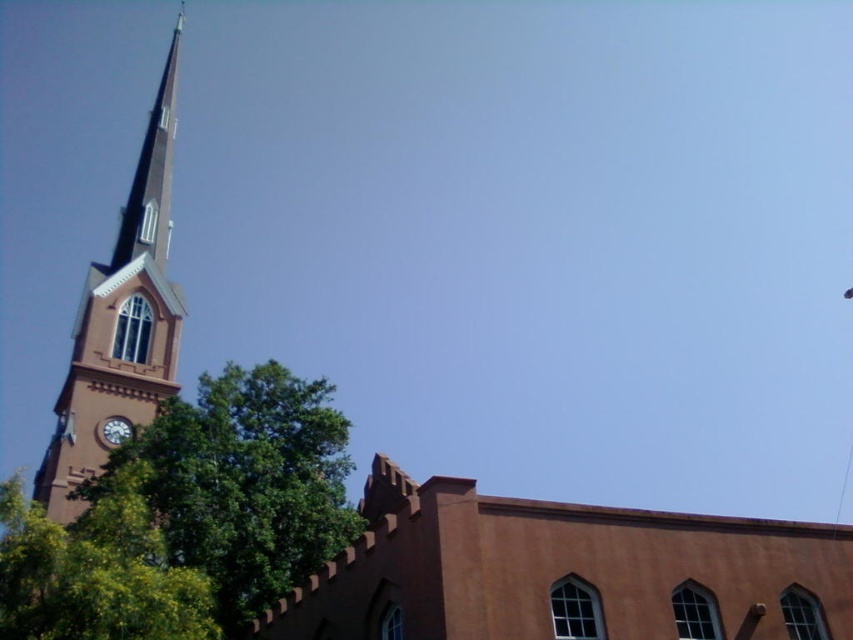
Can you confirm if green leafy tree at center is positioned to the left of smooth brown clock tower at left?

In fact, green leafy tree at center is to the right of smooth brown clock tower at left.

Image resolution: width=853 pixels, height=640 pixels. Describe the element at coordinates (244, 483) in the screenshot. I see `green leafy tree at center` at that location.

Measure the distance between point (x=296, y=432) and camera.

Point (x=296, y=432) and camera are 56.00 meters apart.

Where is `green leafy tree at center`? green leafy tree at center is located at coordinates (244, 483).

Which is above, brown matte church at center or green leafy tree at center?

green leafy tree at center is above.

Which is more to the left, brown matte church at center or green leafy tree at center?

Positioned to the left is green leafy tree at center.

At what (x,y) coordinates should I click in order to perform the action: click on brown matte church at center. Please return your answer as a coordinate pair (x, y). Looking at the image, I should click on (566, 572).

Can you confirm if green leafy tree at center is thinner than green leafy tree at lower left?

In fact, green leafy tree at center might be wider than green leafy tree at lower left.

Between point (163, 493) and point (119, 493), which one is positioned behind?

Point (163, 493)

Based on the photo, who is more distant from viewer, (311,548) or (106,621)?

The point (311,548) is behind.

You are a GUI agent. You are given a task and a screenshot of the screen. Output one action in this format:
    pyautogui.click(x=<x>, y=<y>)
    Task: Click on the green leafy tree at center
    This screenshot has height=640, width=853.
    Given the screenshot: What is the action you would take?
    pyautogui.click(x=244, y=483)